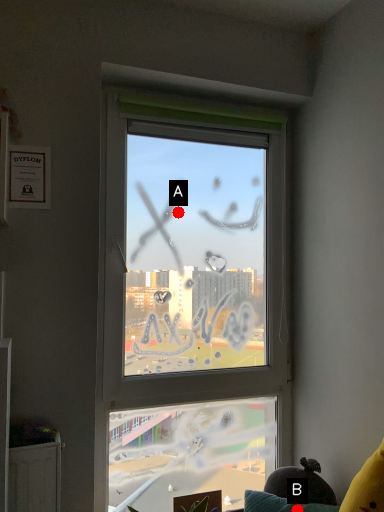
Question: Two points are circled on the image, labeled by A and B beside each circle. Which point is closer to the camera taking this photo?

Choices:
 (A) A is closer
 (B) B is closer

Answer: (B)